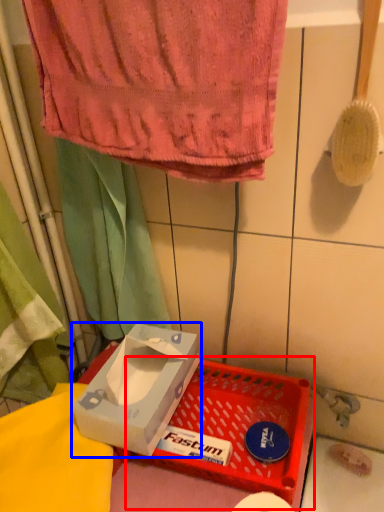
Question: Among these objects, which one is nearest to the camera, basket (highlighted by a red box) or box (highlighted by a blue box)?

Choices:
 (A) basket
 (B) box

Answer: (A)